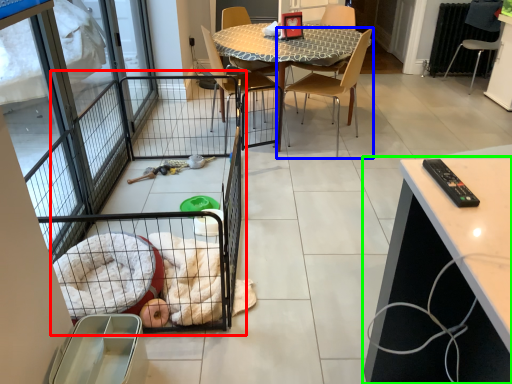
Question: Which is farther away from balcony (highlighted by a red box)? chair (highlighted by a blue box) or cabinetry (highlighted by a green box)?

Choices:
 (A) chair
 (B) cabinetry

Answer: (A)